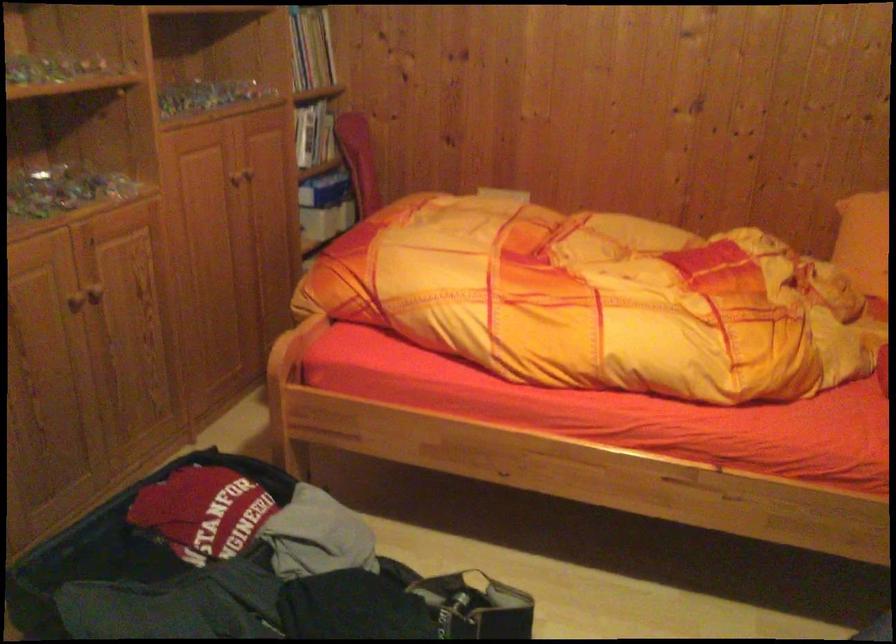
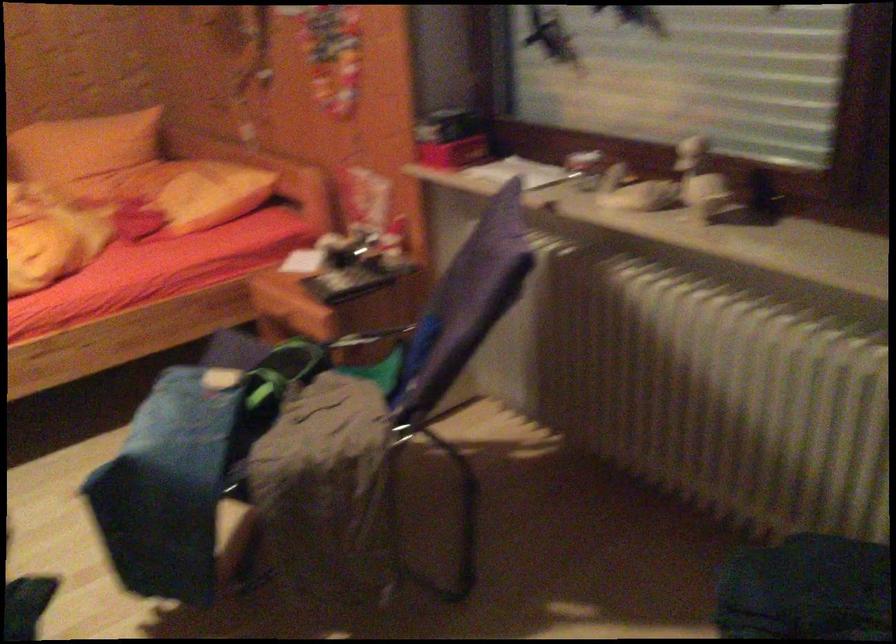
Question: The camera is either moving clockwise (left) or counter-clockwise (right) around the object. The first image is from the beginning of the video and the second image is from the end. Is the camera moving left or right when shooting the video?

Choices:
 (A) Left
 (B) Right

Answer: (A)